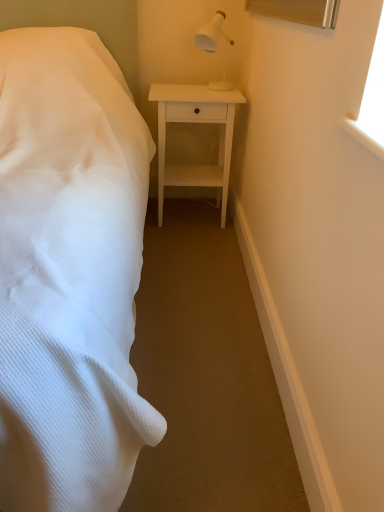
Measure the distance between point [55,49] and camera.

1.87 meters.

I want to click on white textured bed at left, so click(x=69, y=273).

In the scene shown: Considering the sizes of objects white matte nightstand at center and white textured bed at left in the image provided, who is bigger, white matte nightstand at center or white textured bed at left?

With larger size is white textured bed at left.

Would you say white textured bed at left is part of white matte nightstand at center's contents?

No, white textured bed at left is located outside of white matte nightstand at center.

From a real-world perspective, is white matte nightstand at center positioned above or below white textured bed at left?

white matte nightstand at center is situated lower than white textured bed at left in the real world.

From the image's perspective, does white plastic lamp at upper right appear higher than white matte nightstand at center?

Yes, from the image's perspective, white plastic lamp at upper right is on top of white matte nightstand at center.

Looking at this image, from a real-world perspective, which is physically above, white plastic lamp at upper right or white matte nightstand at center?

white plastic lamp at upper right.

Is white plastic lamp at upper right placed right next to white matte nightstand at center?

No, white plastic lamp at upper right is not next to white matte nightstand at center.

Is white plastic lamp at upper right taller than white matte nightstand at center?

Incorrect, the height of white plastic lamp at upper right is not larger of that of white matte nightstand at center.

Which object is further away from the camera taking this photo, white textured bed at left or white plastic lamp at upper right?

white plastic lamp at upper right.

Is white plastic lamp at upper right at the back of white textured bed at left?

white textured bed at left is not turned away from white plastic lamp at upper right.

Is white textured bed at left positioned far away from white plastic lamp at upper right?

Yes, white textured bed at left and white plastic lamp at upper right are quite far apart.

From a real-world perspective, is white plastic lamp at upper right positioned under white textured bed at left based on gravity?

Incorrect, from a real-world perspective, white plastic lamp at upper right is higher than white textured bed at left.

Is white plastic lamp at upper right oriented away from white textured bed at left?

No, white plastic lamp at upper right is not facing away from white textured bed at left.

What's the angular difference between white plastic lamp at upper right and white textured bed at left's facing directions?

1.91 degrees.

Is white matte nightstand at center bigger than white plastic lamp at upper right?

Correct, white matte nightstand at center is larger in size than white plastic lamp at upper right.

Is white matte nightstand at center surrounding white plastic lamp at upper right?

No, white plastic lamp at upper right is not inside white matte nightstand at center.

From the image's perspective, is white matte nightstand at center above or below white plastic lamp at upper right?

Based on their image positions, white matte nightstand at center is located beneath white plastic lamp at upper right.

Can white matte nightstand at center be found inside white textured bed at left?

Yes, white matte nightstand at center can be found within white textured bed at left.

Is white textured bed at left in front of white matte nightstand at center?

Yes.

Is white textured bed at left aimed at white matte nightstand at center?

No, white textured bed at left is not facing towards white matte nightstand at center.

Locate an element on the screen. bed below the white matte nightstand at center (from the image's perspective) is located at coordinates pos(69,273).

Locate an element on the screen. The image size is (384, 512). bedside lamp in front of the white matte nightstand at center is located at coordinates (215, 46).

Which object lies further to the anchor point white matte nightstand at center, white textured bed at left or white plastic lamp at upper right?

white textured bed at left.

Which object lies nearer to the anchor point white plastic lamp at upper right, white matte nightstand at center or white textured bed at left?

Among the two, white matte nightstand at center is located nearer to white plastic lamp at upper right.

Based on their spatial positions, is white plastic lamp at upper right or white textured bed at left further from white matte nightstand at center?

Among the two, white textured bed at left is located further to white matte nightstand at center.

When comparing their distances from white plastic lamp at upper right, does white textured bed at left or white matte nightstand at center seem further?

white textured bed at left.

Considering their positions, is white plastic lamp at upper right positioned further to white textured bed at left than white matte nightstand at center?

The object further to white textured bed at left is white plastic lamp at upper right.

Looking at the image, which one is located further to white textured bed at left, white matte nightstand at center or white plastic lamp at upper right?

white plastic lamp at upper right is further to white textured bed at left.

Where is `bedside lamp between white textured bed at left and white matte nightstand at center along the z-axis`? The image size is (384, 512). bedside lamp between white textured bed at left and white matte nightstand at center along the z-axis is located at coordinates (215, 46).